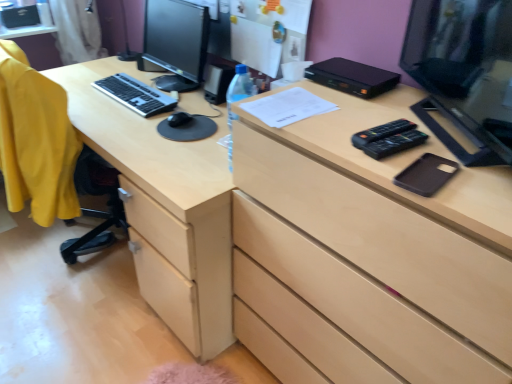
Find the location of a particular element. vacant region to the left of black matte mouse at center is located at coordinates (138, 111).